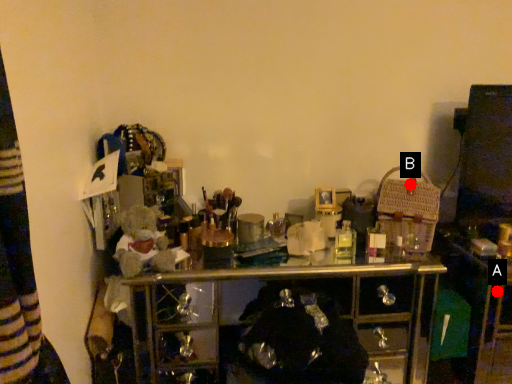
Question: Two points are circled on the image, labeled by A and B beside each circle. Which point is further to the camera?

Choices:
 (A) A is further
 (B) B is further

Answer: (B)